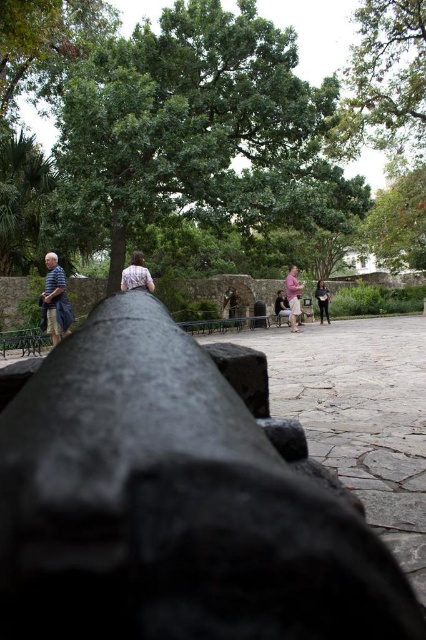
You are a historical reenactor in the courtyard. You notice two participants dressed in period attire. One has dark gray pants at center and another has a matte black jacket at center. Which clothing item is positioned higher on their body?

The dark gray pants at center is above the matte black jacket at center, so the dark gray pants at center is positioned higher on their body.

You are a photographer standing near the cannon in the courtyard. You want to take a photo that includes both the light brown leather jacket at center and the pink fabric shirt at center. Which one will appear larger in the photo?

The light brown leather jacket at center will appear larger in the photo because it is closer to the viewer than the pink fabric shirt at center.

You are a photographer standing near the large cannon in the foreground of the courtyard. You want to take a photo of the light brown leather jacket at center without moving the jacket. Can you position yourself so that you are exactly 37.48 feet away from the jacket while still being able to see both the jacket and the large cannon in your shot? Explain your reasoning.

Yes, since the light brown leather jacket at center and camera are 37.48 feet apart, positioning the camera exactly at that distance allows the photographer to capture both the jacket and the large cannon in the foreground within the same frame.